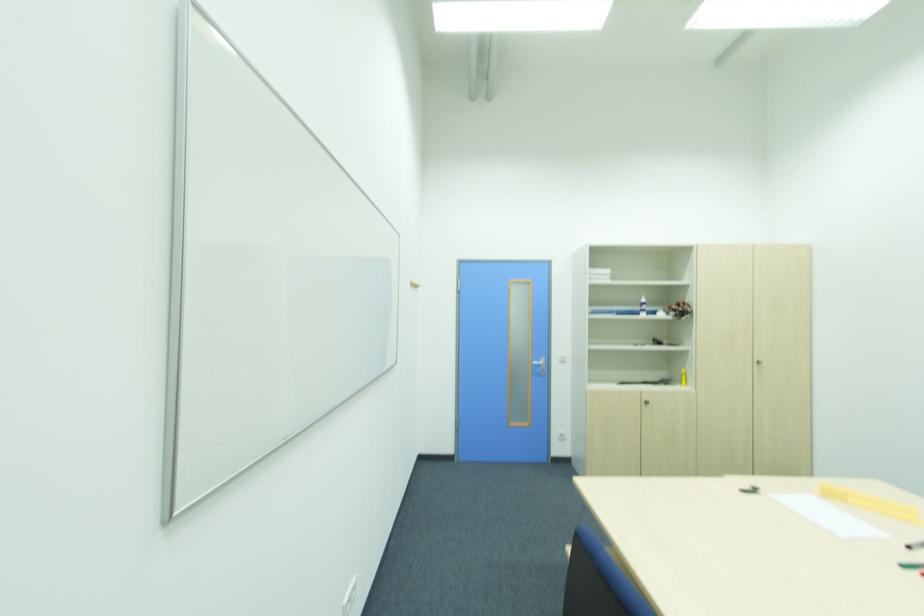
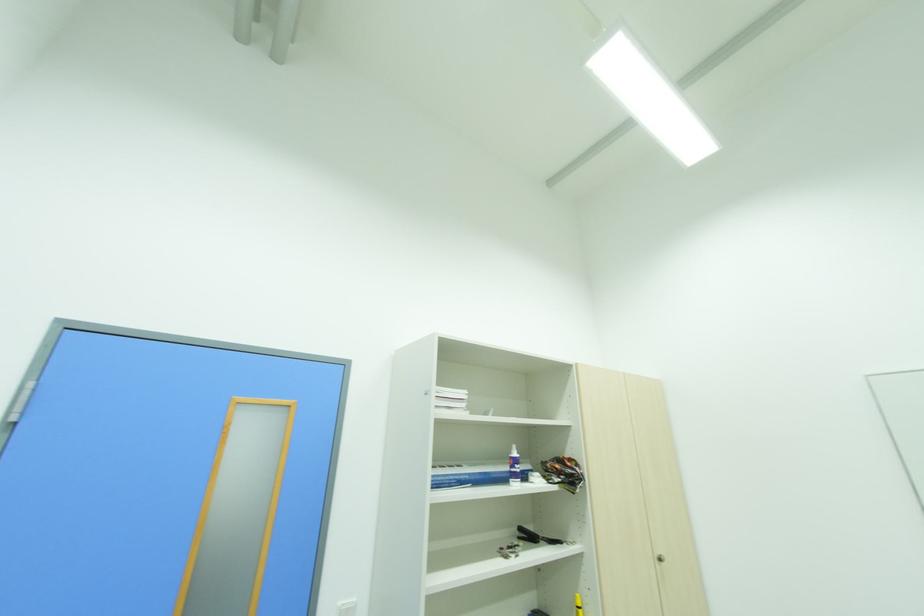
The point at (x=647, y=301) is marked in the first image. Where is the corresponding point in the second image?

(517, 455)